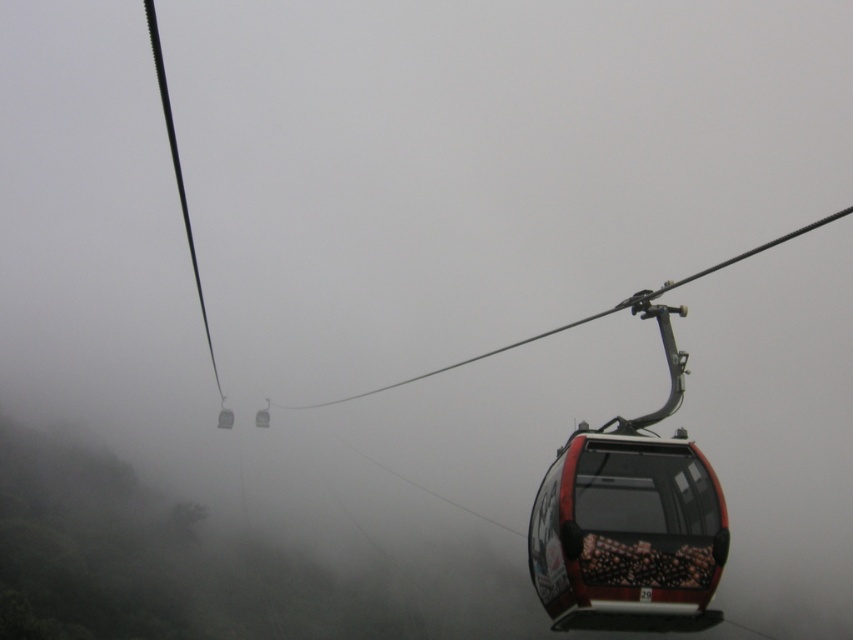
You are standing at the point with coordinates [225,419] in the foggy cable car scene. What object are you currently located on?

The point at coordinates [225,419] corresponds to the metallic gray cable car at center, so you are currently located on the metallic gray cable car at center.

You are a passenger on the cable car line and want to board the first available cable car. You see the metallic red cable car at center and the metallic gray cable car at center. Which one is closer to the boarding station?

The metallic gray cable car at center is closer to the boarding station because it is positioned to the left of the metallic red cable car at center, and since the cable cars move from left to right, the metallic gray cable car at center would arrive first.

You are a photographer trying to capture the cable car scene. You notice two points in the image at coordinates point (645,480) and point (257,412). If you want to focus on the point that is closer to your camera, which coordinate should you adjust your lens to?

Point (645,480) is closer to the camera than point (257,412), so you should adjust your lens to focus on point (645,480).